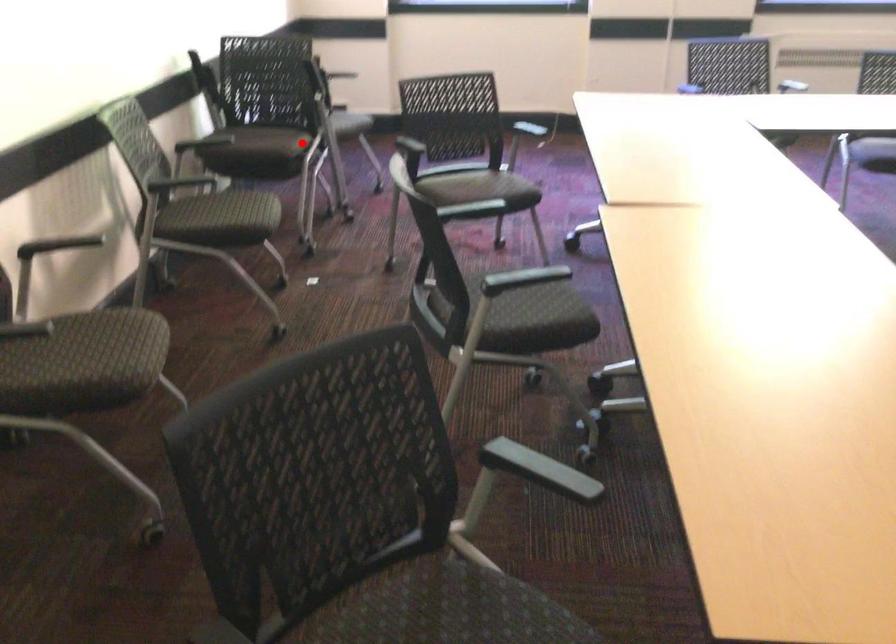
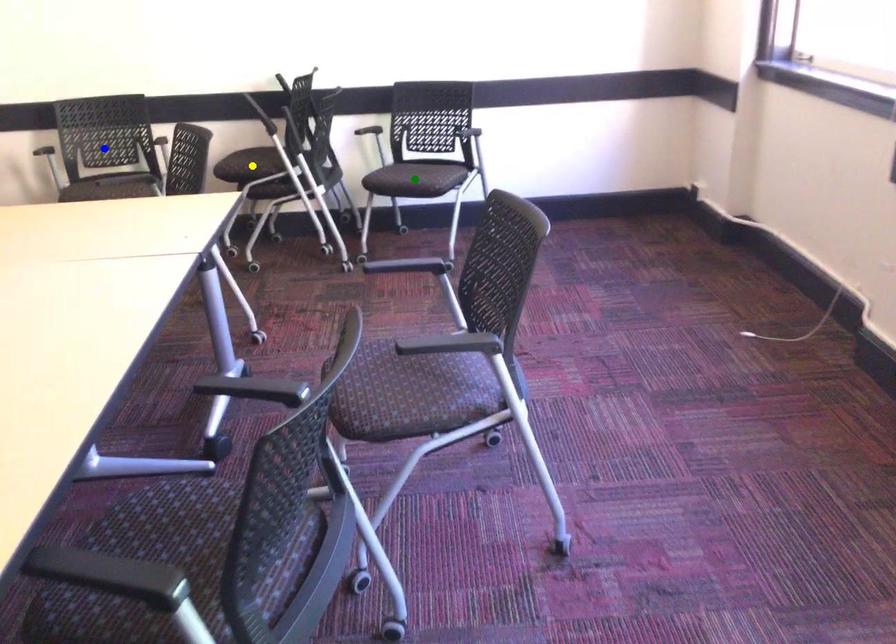
Question: I am providing you with two images of the same scene from different viewpoints. A red point is marked on the first image. You are given multiple points on the second image. Which spot in image 2 lines up with the point in image 1?

Choices:
 (A) green point
 (B) yellow point
 (C) blue point

Answer: (B)